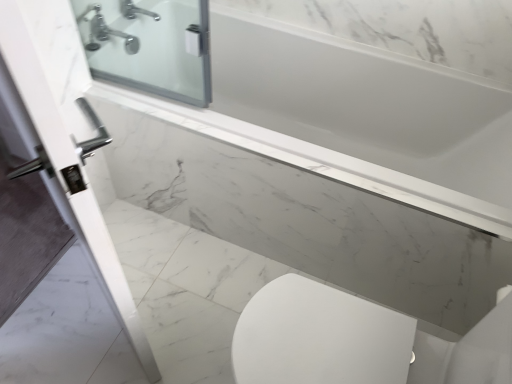
Locate an element on the screen. This screenshot has height=384, width=512. vacant area situated to the left side of white marble ledge at upper center is located at coordinates (164, 280).